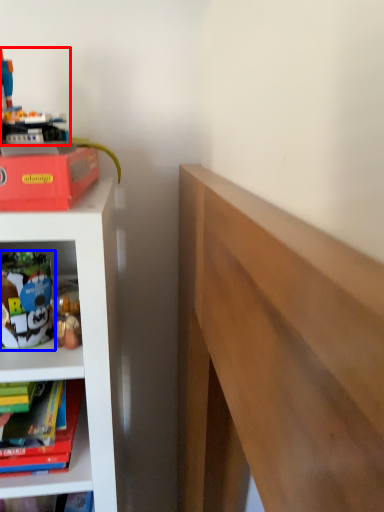
Question: Which of the following is the closest to the observer, toy (highlighted by a red box) or toy (highlighted by a blue box)?

Choices:
 (A) toy
 (B) toy

Answer: (A)